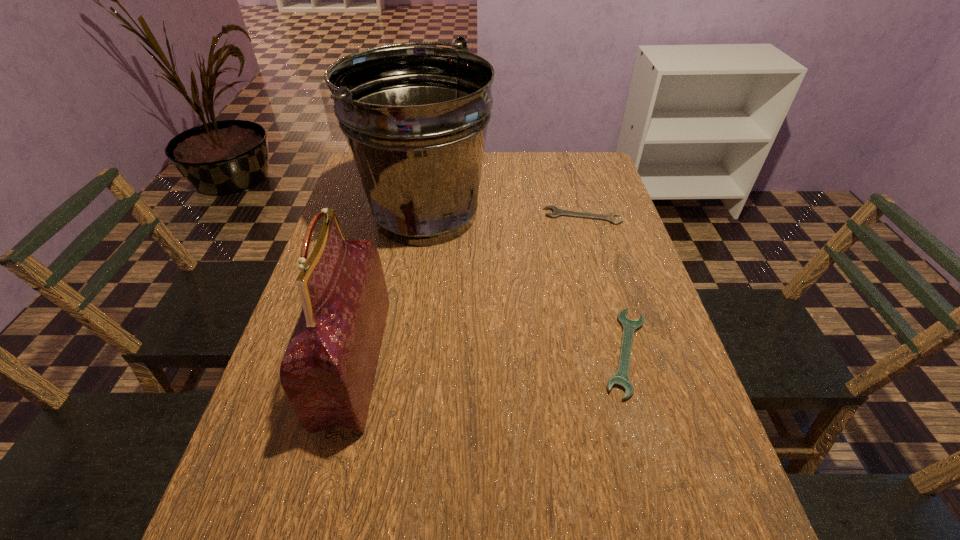
This screenshot has height=540, width=960. Identify the location of vacant space that satisfies the following two spatial constraints: 1. on the front side of the nearer wrench; 2. on the front-facing side of the third shortest object. coord(629,362).

Locate an element on the screen. This screenshot has height=540, width=960. vacant space that satisfies the following two spatial constraints: 1. on the front side of the bucket; 2. on the right side of the nearer wrench is located at coordinates (405, 353).